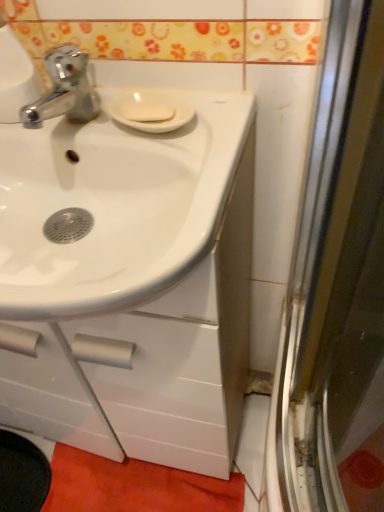
You are a GUI agent. You are given a task and a screenshot of the screen. Output one action in this format:
    pyautogui.click(x=<x>, y=<y>)
    Task: Click on the white matte soap at center
    The height and width of the screenshot is (512, 384).
    Given the screenshot: What is the action you would take?
    pyautogui.click(x=147, y=111)

The image size is (384, 512). Identify the location of orange fabric bath mat at lower center. (135, 486).

Is white glossy sink at center at the back of white matte soap at center?

That's right, white matte soap at center is facing away from white glossy sink at center.

Is point (124, 113) closer to viewer compared to point (2, 307)?

No, (124, 113) is behind (2, 307).

Is white matte soap at center with white glossy sink at center?

white matte soap at center is not next to white glossy sink at center, and they're not touching.

Consider the image. Is white matte soap at center inside the boundaries of white glossy sink at center, or outside?

white matte soap at center is spatially positioned inside white glossy sink at center.

Is orange fabric bath mat at lower center completely or partially outside of white matte soap at center?

Yes, orange fabric bath mat at lower center is located beyond the bounds of white matte soap at center.

From the image's perspective, between orange fabric bath mat at lower center and white matte soap at center, who is located below?

orange fabric bath mat at lower center, from the image's perspective.

Can you confirm if orange fabric bath mat at lower center is taller than white matte soap at center?

Yes.

From the picture: Which point is more distant from viewer, (197, 477) or (125, 109)?

The point (197, 477) is farther from the camera.

Is white glossy sink at center to the left or to the right of white matte soap at center in the image?

In the image, white glossy sink at center appears on the left side of white matte soap at center.

In the scene shown: Can you tell me how much white glossy sink at center and white matte soap at center differ in facing direction?

The angle between the facing direction of white glossy sink at center and the facing direction of white matte soap at center is 8.45 degrees.

Does white glossy sink at center touch white matte soap at center?

white glossy sink at center and white matte soap at center are clearly separated.

From the image's perspective, is white glossy sink at center above white matte soap at center?

No, from the image's perspective, white glossy sink at center is not above white matte soap at center.

Can you confirm if white glossy sink at center is shorter than orange fabric bath mat at lower center?

No, white glossy sink at center is not shorter than orange fabric bath mat at lower center.

Which is more to the right, white glossy sink at center or orange fabric bath mat at lower center?

orange fabric bath mat at lower center.

Measure the distance from white glossy sink at center to orange fabric bath mat at lower center.

white glossy sink at center and orange fabric bath mat at lower center are 30.75 inches apart.

How many degrees apart are the facing directions of white glossy sink at center and orange fabric bath mat at lower center?

white glossy sink at center and orange fabric bath mat at lower center are facing 4.72 degrees away from each other.

Considering the positions of objects white matte soap at center and orange fabric bath mat at lower center in the image provided, who is more to the left, white matte soap at center or orange fabric bath mat at lower center?

From the viewer's perspective, orange fabric bath mat at lower center appears more on the left side.

Is there a large distance between white matte soap at center and orange fabric bath mat at lower center?

No.

From the image's perspective, does white matte soap at center appear lower than orange fabric bath mat at lower center?

No.

Between white matte soap at center and orange fabric bath mat at lower center, which one has more height?

Standing taller between the two is orange fabric bath mat at lower center.

Is orange fabric bath mat at lower center at the right side of white glossy sink at center?

Yes, orange fabric bath mat at lower center is to the right of white glossy sink at center.

From a real-world perspective, between orange fabric bath mat at lower center and white glossy sink at center, who is vertically higher?

white glossy sink at center.

Is orange fabric bath mat at lower center facing towards white glossy sink at center?

No.

How different are the orientations of orange fabric bath mat at lower center and white glossy sink at center in degrees?

There is a 4.72-degree angle between the facing directions of orange fabric bath mat at lower center and white glossy sink at center.

Identify the location of sink below the white matte soap at center (from the image's perspective). The height and width of the screenshot is (512, 384). (112, 193).

The image size is (384, 512). In order to click on soap on the right of orange fabric bath mat at lower center in this screenshot , I will do `click(147, 111)`.

Estimate the real-world distances between objects in this image. Which object is further from white matte soap at center, white glossy sink at center or orange fabric bath mat at lower center?

orange fabric bath mat at lower center.

Based on their spatial positions, is orange fabric bath mat at lower center or white matte soap at center further from white glossy sink at center?

The object further to white glossy sink at center is orange fabric bath mat at lower center.

Based on the photo, from the image, which object appears to be nearer to white glossy sink at center, white matte soap at center or orange fabric bath mat at lower center?

The object closer to white glossy sink at center is white matte soap at center.

From the image, which object appears to be farther from orange fabric bath mat at lower center, white matte soap at center or white glossy sink at center?

white matte soap at center.

Based on their spatial positions, is orange fabric bath mat at lower center or white glossy sink at center closer to white matte soap at center?

white glossy sink at center lies closer to white matte soap at center than the other object.

Which object lies nearer to the anchor point orange fabric bath mat at lower center, white glossy sink at center or white matte soap at center?

white glossy sink at center lies closer to orange fabric bath mat at lower center than the other object.

Locate an element on the screen. The width and height of the screenshot is (384, 512). sink between white matte soap at center and orange fabric bath mat at lower center vertically is located at coordinates (112, 193).